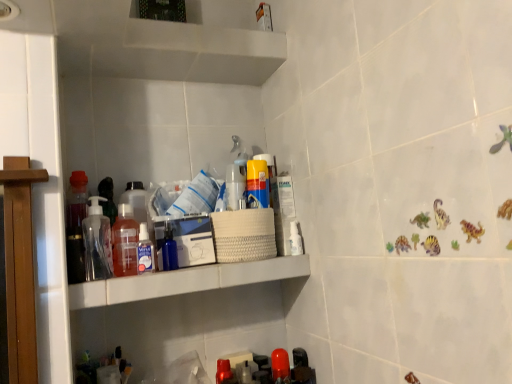
Identify the location of vacant area that lies between white plastic bottle at upper right, the first toiletry when ordered from back to front, and translucent plastic bottle at center, the second bottle positioned from the right. This screenshot has width=512, height=384. (217, 265).